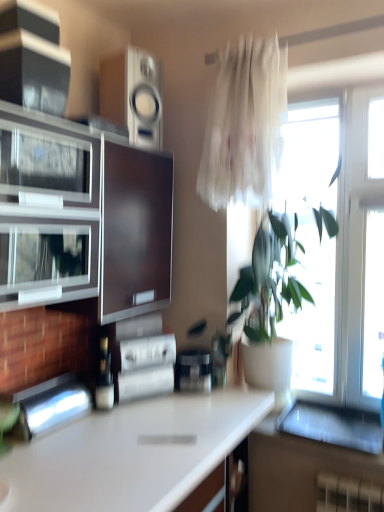
Where is `vacant area on top of transparent glass window at right (from a real-world perspective)`? The image size is (384, 512). vacant area on top of transparent glass window at right (from a real-world perspective) is located at coordinates (335, 84).